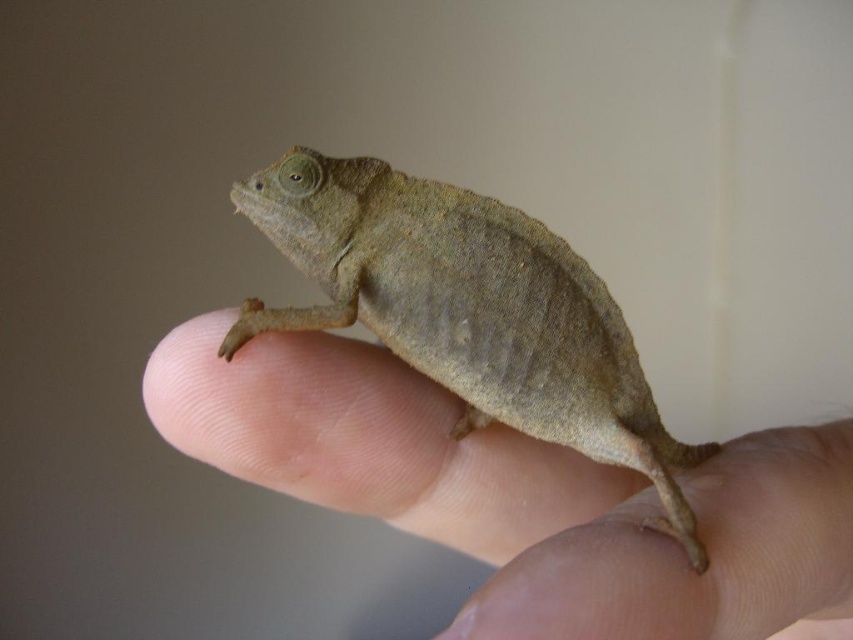
Question: Which object appears farthest from the camera in this image?

Choices:
 (A) brown textured lizard at center
 (B) brown matte chameleon at center
 (C) matte brown chameleon at center

Answer: (A)

Question: Does brown textured lizard at center have a smaller size compared to matte brown chameleon at center?

Choices:
 (A) no
 (B) yes

Answer: (B)

Question: Which of the following is the farthest from the observer?

Choices:
 (A) (769, 630)
 (B) (801, 486)
 (C) (577, 378)

Answer: (C)

Question: Can you confirm if brown matte chameleon at center is smaller than matte brown chameleon at center?

Choices:
 (A) no
 (B) yes

Answer: (A)

Question: Which point appears farthest from the camera in this image?

Choices:
 (A) (701, 552)
 (B) (329, 438)
 (C) (613, 548)

Answer: (B)

Question: Is brown matte chameleon at center bigger than brown textured lizard at center?

Choices:
 (A) yes
 (B) no

Answer: (A)